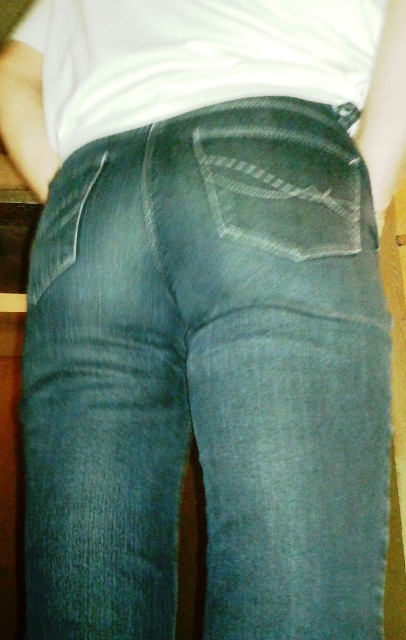
Is white matte shirt at upper center positioned before denim pocket at center?

No, it is not.

Describe the element at coordinates (192, 58) in the screenshot. I see `white matte shirt at upper center` at that location.

Which is behind, point (114, 76) or point (241, 209)?

Positioned behind is point (114, 76).

Identify the location of white matte shirt at upper center. (192, 58).